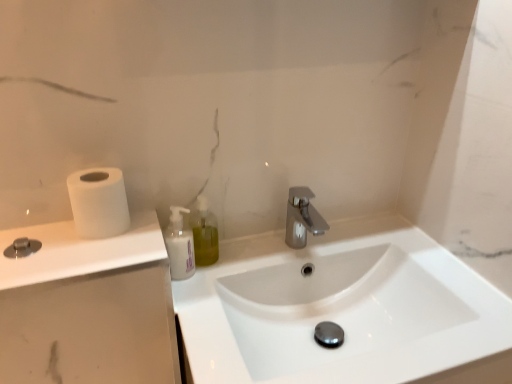
At what (x,y) coordinates should I click in order to perform the action: click on empty space that is in between white matte bottle at center and polished chrome faucet at center. Please return your answer as a coordinate pair (x, y). Image resolution: width=512 pixels, height=384 pixels. Looking at the image, I should click on (243, 257).